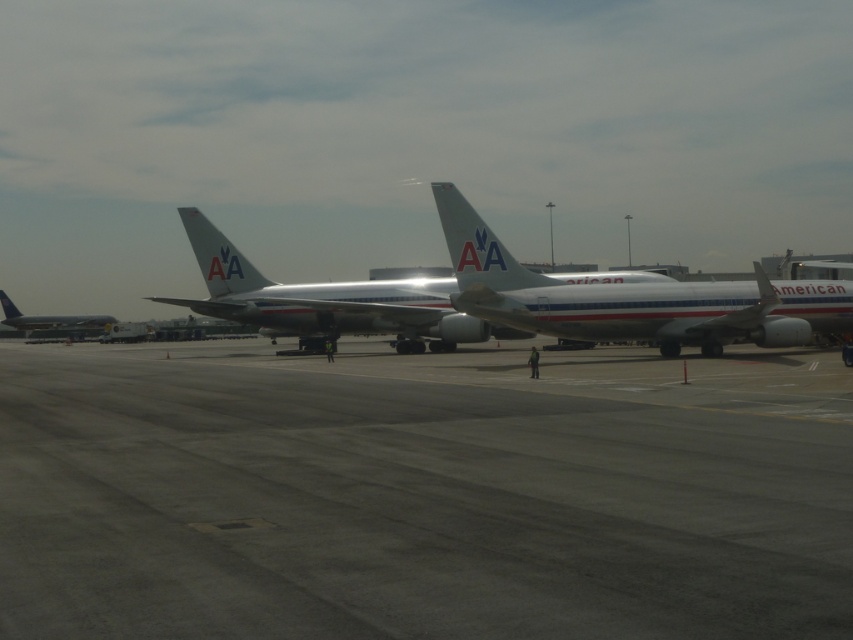
Who is more forward, [679,316] or [13,323]?

Positioned in front is point [679,316].

Does white metallic airplane at center have a lesser width compared to metallic silver airplane at left?

Yes, white metallic airplane at center is thinner than metallic silver airplane at left.

Is point (694, 305) behind point (18, 308)?

No, (694, 305) is closer to viewer.

Where is `white metallic airplane at center`? This screenshot has width=853, height=640. white metallic airplane at center is located at coordinates (630, 298).

Does gray asphalt runway at center have a larger size compared to silver metallic airplane at center?

Incorrect, gray asphalt runway at center is not larger than silver metallic airplane at center.

What do you see at coordinates (422, 492) in the screenshot? I see `gray asphalt runway at center` at bounding box center [422, 492].

Between point (329, 529) and point (398, 288), which one is positioned behind?

The point (398, 288) is more distant.

At what (x,y) coordinates should I click in order to perform the action: click on gray asphalt runway at center. Please return your answer as a coordinate pair (x, y). The height and width of the screenshot is (640, 853). Looking at the image, I should click on (422, 492).

Does gray asphalt runway at center have a lesser width compared to white metallic airplane at center?

No, gray asphalt runway at center is not thinner than white metallic airplane at center.

Is gray asphalt runway at center positioned at the back of white metallic airplane at center?

That is False.

Describe the element at coordinates (422, 492) in the screenshot. I see `gray asphalt runway at center` at that location.

Where is `gray asphalt runway at center`? gray asphalt runway at center is located at coordinates (422, 492).